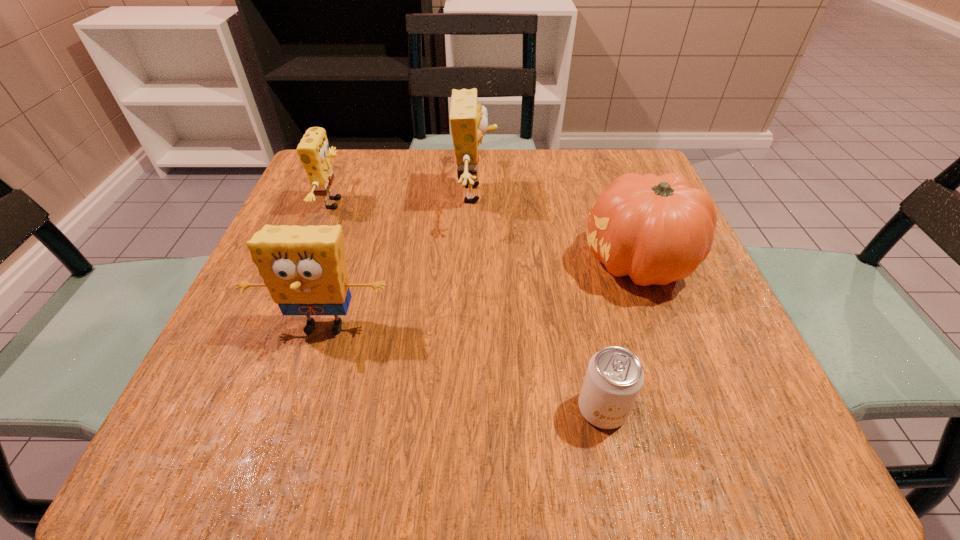
This screenshot has width=960, height=540. I want to click on vacant space located on the carved face of the pumpkin, so click(x=410, y=262).

Identify the location of vacant space located on the face of the shortest sponge. This screenshot has width=960, height=540. (432, 204).

Locate an element on the screen. This screenshot has height=540, width=960. free location located on the back of the nearest object is located at coordinates (569, 253).

You are a GUI agent. You are given a task and a screenshot of the screen. Output one action in this format:
    pyautogui.click(x=<x>, y=<y>)
    Task: Click on the object that is at the near edge
    
    Given the screenshot: What is the action you would take?
    pyautogui.click(x=614, y=377)

Locate an element on the screen. This screenshot has height=540, width=960. object present at the right edge is located at coordinates [657, 229].

At what (x,y) coordinates should I click in order to perform the action: click on object that is at the far left corner. Please return your answer as a coordinate pair (x, y). Looking at the image, I should click on (314, 153).

At what (x,y) coordinates should I click in order to perform the action: click on vacant area at the far edge of the desktop. Please return your answer as a coordinate pair (x, y). Image resolution: width=960 pixels, height=540 pixels. Looking at the image, I should click on (379, 168).

Identify the location of vacant space at the left edge of the desktop. The height and width of the screenshot is (540, 960). (240, 383).

In the image, there is a desktop. Where is `free space at the right edge`? free space at the right edge is located at coordinates (722, 353).

At what (x,y) coordinates should I click in order to perform the action: click on vacant space at the far left corner of the desktop. Please return your answer as a coordinate pair (x, y). The width and height of the screenshot is (960, 540). Looking at the image, I should click on (368, 173).